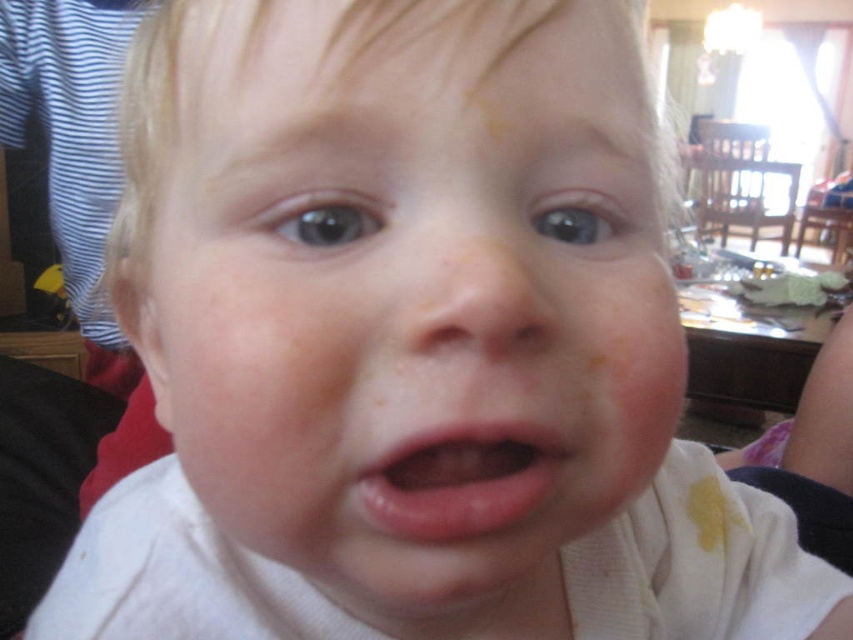
You are a photographer adjusting the focus on your camera. You want to ensure both the smooth skin face at center and the pink smooth lips at center are in sharp focus. Given that your camera can only focus precisely on objects within a 1.5 inch range, will both areas be in focus?

The smooth skin face at center is 2.25 inches away from pink smooth lips at center. Since the distance between them exceeds the camera focus range of 1.5 inches, both areas cannot be in focus simultaneously.

You are a photographer adjusting the focus on your camera. You want to ensure that both the smooth skin face at center and the pink smooth lips at center are in focus. Based on their positions, which one should you focus on first to achieve sharpness for both?

The smooth skin face at center is closer to the viewer than the pink smooth lips at center. To get both in focus, focus on the smooth skin face at center first.